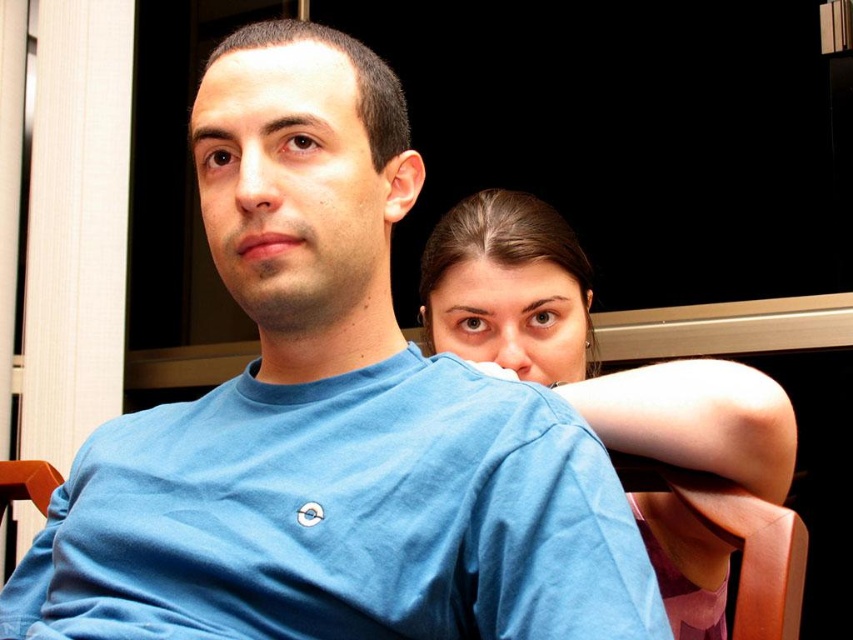
You are a photographer setting up a studio. You need to position a spotlight so that it illuminates both the smooth skin face at upper right and the brown wood chair at lower right without casting shadows on the background wall. Given their positions, where should you place the spotlight relative to these objects?

The smooth skin face at upper right is above the brown wood chair at lower right, so placing the spotlight above and slightly forward of both objects would ensure even illumination while minimizing shadows on the background wall.

You are a photographer setting up a shot in this scene. You need to ensure that both the smooth skin face at upper right and the brown wood chair at lower right are visible in the frame. Given their positions, which object is closer to the left edge of the image?

The smooth skin face at upper right is positioned on the left side of brown wood chair at lower right, so the smooth skin face at upper right is closer to the left edge of the image.

You are a photographer trying to capture a candid shot of two people sitting close. The subject in the blue shirt is at point (582, 282). If you want to ensure both subjects are in focus, what is the minimum distance you should set your camera lens to focus on?

The subjects are 37.59 inches apart, so the camera lens should be set to focus at least 37.59 inches away to ensure both are in focus.